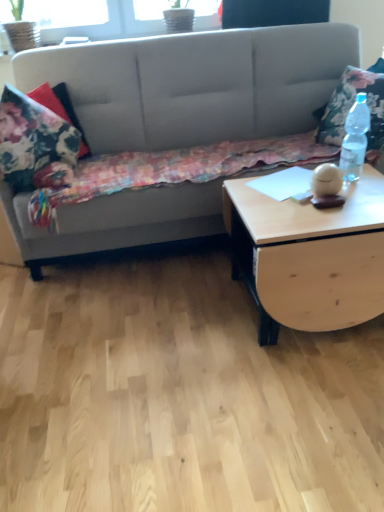
Question: From the image's perspective, is suede gray couch at upper left located beneath floral fabric pillow at right?

Choices:
 (A) no
 (B) yes

Answer: (B)

Question: Can you confirm if suede gray couch at upper left is smaller than floral fabric pillow at right?

Choices:
 (A) no
 (B) yes

Answer: (A)

Question: Does suede gray couch at upper left turn towards floral fabric pillow at right?

Choices:
 (A) yes
 (B) no

Answer: (A)

Question: Is suede gray couch at upper left directly adjacent to floral fabric pillow at right?

Choices:
 (A) yes
 (B) no

Answer: (B)

Question: Considering the relative sizes of suede gray couch at upper left and floral fabric pillow at right in the image provided, is suede gray couch at upper left taller than floral fabric pillow at right?

Choices:
 (A) yes
 (B) no

Answer: (A)

Question: Can you confirm if suede gray couch at upper left is thinner than floral fabric pillow at right?

Choices:
 (A) no
 (B) yes

Answer: (A)

Question: From a real-world perspective, is clear plastic bottle at right below floral fabric blanket at left?

Choices:
 (A) yes
 (B) no

Answer: (B)

Question: Is clear plastic bottle at right in contact with floral fabric blanket at left?

Choices:
 (A) yes
 (B) no

Answer: (B)

Question: From the image's perspective, is clear plastic bottle at right located beneath floral fabric blanket at left?

Choices:
 (A) yes
 (B) no

Answer: (B)

Question: From the image's perspective, is clear plastic bottle at right over floral fabric blanket at left?

Choices:
 (A) yes
 (B) no

Answer: (A)

Question: Is clear plastic bottle at right surrounding floral fabric blanket at left?

Choices:
 (A) no
 (B) yes

Answer: (A)

Question: Considering the relative sizes of clear plastic bottle at right and floral fabric blanket at left in the image provided, is clear plastic bottle at right taller than floral fabric blanket at left?

Choices:
 (A) yes
 (B) no

Answer: (A)

Question: Is light wood/texture coffee table at right wider than floral fabric blanket at left?

Choices:
 (A) no
 (B) yes

Answer: (A)